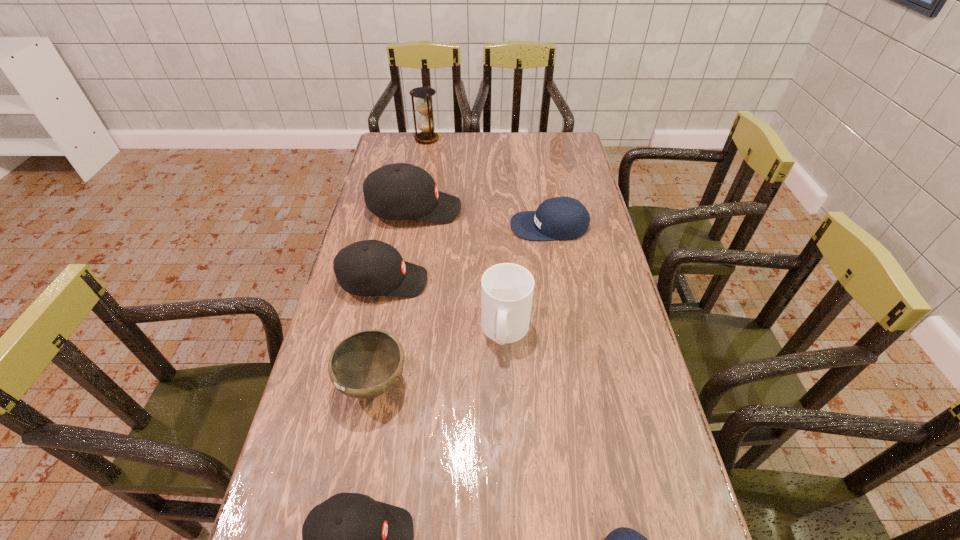
At what (x,y) coordinates should I click in order to perform the action: click on hourglass. Please return your answer as a coordinate pair (x, y). Image resolution: width=960 pixels, height=540 pixels. Looking at the image, I should click on (423, 104).

Image resolution: width=960 pixels, height=540 pixels. I want to click on the tallest object, so click(x=423, y=104).

Locate an element on the screen. Image resolution: width=960 pixels, height=540 pixels. white mug is located at coordinates tap(507, 289).

Identify the location of the farthest gray baseball cap. The width and height of the screenshot is (960, 540). (401, 191).

Locate an element on the screen. The image size is (960, 540). the tallest baseball cap is located at coordinates (401, 191).

The width and height of the screenshot is (960, 540). Find the location of `the second tallest baseball cap`. the second tallest baseball cap is located at coordinates click(371, 267).

The width and height of the screenshot is (960, 540). In order to click on the fifth shortest object in this screenshot , I will do `click(371, 267)`.

The height and width of the screenshot is (540, 960). In order to click on bowl in this screenshot , I will do `click(366, 364)`.

Image resolution: width=960 pixels, height=540 pixels. Identify the location of the bigger blue baseball cap. (564, 218).

Identify the location of blank space located 0.300m on the front of the farthest object. Image resolution: width=960 pixels, height=540 pixels. (419, 186).